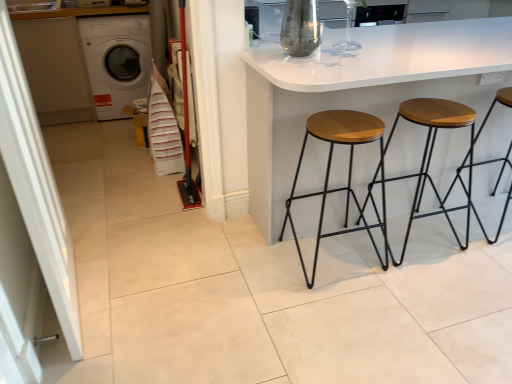
Find the location of a particular element. free space in front of wooden/metallic stool at center, which is counted as the second stool, starting from the left is located at coordinates (437, 285).